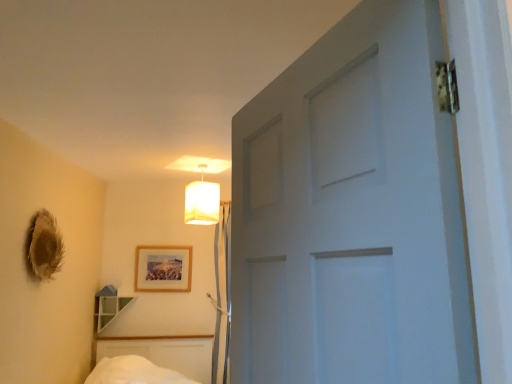
This screenshot has width=512, height=384. Describe the element at coordinates (202, 201) in the screenshot. I see `matte white lampshade at upper center` at that location.

Find the location of a particular element. The height and width of the screenshot is (384, 512). matte white lampshade at upper center is located at coordinates (202, 201).

In order to click on picture frame behind the matte white lampshade at upper center in this screenshot , I will do `click(163, 269)`.

Is wooden picture frame at center in contact with matte white lampshade at upper center?

wooden picture frame at center and matte white lampshade at upper center are not in contact.

Relative to matte white lampshade at upper center, is wooden picture frame at center in front or behind?

wooden picture frame at center is positioned farther from the viewer than matte white lampshade at upper center.

How much distance is there between wooden picture frame at center and matte white lampshade at upper center?

A distance of 31.35 inches exists between wooden picture frame at center and matte white lampshade at upper center.

Find the location of a particular element. The image size is (512, 384). lamp on the right of wooden picture frame at center is located at coordinates (202, 201).

From a real-world perspective, is matte white lampshade at upper center beneath wooden picture frame at center?

No.

Choose the correct answer: Is matte white lampshade at upper center inside wooden picture frame at center or outside it?

The correct answer is: outside.

Is matte white lampshade at upper center taller than wooden picture frame at center?

Yes, matte white lampshade at upper center is taller than wooden picture frame at center.

Is point (121, 299) closer or farther from the camera than point (208, 204)?

Point (121, 299) is farther from the camera than point (208, 204).

Is clear glass shelf at lower left far away from matte white lampshade at upper center?

That's right, there is a large distance between clear glass shelf at lower left and matte white lampshade at upper center.

From the image's perspective, which one is positioned lower, clear glass shelf at lower left or matte white lampshade at upper center?

From the image's view, clear glass shelf at lower left is below.

Can you confirm if matte white lampshade at upper center is thinner than clear glass shelf at lower left?

No, matte white lampshade at upper center is not thinner than clear glass shelf at lower left.

Is clear glass shelf at lower left a part of matte white lampshade at upper center?

No, clear glass shelf at lower left is not inside matte white lampshade at upper center.

From the image's perspective, does matte white lampshade at upper center appear lower than clear glass shelf at lower left?

Actually, matte white lampshade at upper center appears above clear glass shelf at lower left in the image.

Is matte white lampshade at upper center with clear glass shelf at lower left?

matte white lampshade at upper center and clear glass shelf at lower left are clearly separated.

Is point (104, 306) closer or farther from the camera than point (182, 280)?

Point (104, 306) is positioned closer to the camera compared to point (182, 280).

Could you tell me if clear glass shelf at lower left is turned towards wooden picture frame at center?

No, clear glass shelf at lower left is not aimed at wooden picture frame at center.

Consider the image. How many degrees apart are the facing directions of clear glass shelf at lower left and wooden picture frame at center?

There is a 2.6-degree angle between the facing directions of clear glass shelf at lower left and wooden picture frame at center.

Which is correct: clear glass shelf at lower left is inside wooden picture frame at center, or outside of it?

clear glass shelf at lower left is spatially situated outside wooden picture frame at center.

Which is closer, (145, 251) or (106, 320)?

Point (106, 320)

How distant is wooden picture frame at center from clear glass shelf at lower left?

A distance of 15.57 inches exists between wooden picture frame at center and clear glass shelf at lower left.

From their relative heights in the image, would you say wooden picture frame at center is taller or shorter than clear glass shelf at lower left?

Clearly, wooden picture frame at center is taller compared to clear glass shelf at lower left.

Considering their positions, is wooden picture frame at center located in front of or behind clear glass shelf at lower left?

wooden picture frame at center is behind clear glass shelf at lower left.

This screenshot has width=512, height=384. I want to click on picture frame below the matte white lampshade at upper center (from the image's perspective), so click(x=163, y=269).

The height and width of the screenshot is (384, 512). Find the location of `lamp located on the right of wooden picture frame at center`. lamp located on the right of wooden picture frame at center is located at coordinates (202, 201).

Looking at the image, which one is located closer to matte white lampshade at upper center, clear glass shelf at lower left or wooden picture frame at center?

wooden picture frame at center lies closer to matte white lampshade at upper center than the other object.

From the image, which object appears to be nearer to clear glass shelf at lower left, matte white lampshade at upper center or wooden picture frame at center?

wooden picture frame at center is closer to clear glass shelf at lower left.

Which object lies further to the anchor point wooden picture frame at center, clear glass shelf at lower left or matte white lampshade at upper center?

matte white lampshade at upper center lies further to wooden picture frame at center than the other object.

Considering their positions, is wooden picture frame at center positioned closer to matte white lampshade at upper center than clear glass shelf at lower left?

wooden picture frame at center is closer to matte white lampshade at upper center.

When comparing their distances from clear glass shelf at lower left, does wooden picture frame at center or matte white lampshade at upper center seem closer?

The object closer to clear glass shelf at lower left is wooden picture frame at center.

From the image, which object appears to be farther from wooden picture frame at center, matte white lampshade at upper center or clear glass shelf at lower left?

matte white lampshade at upper center.

Find the location of a particular element. The height and width of the screenshot is (384, 512). picture frame between matte white lampshade at upper center and clear glass shelf at lower left in the up-down direction is located at coordinates (163, 269).